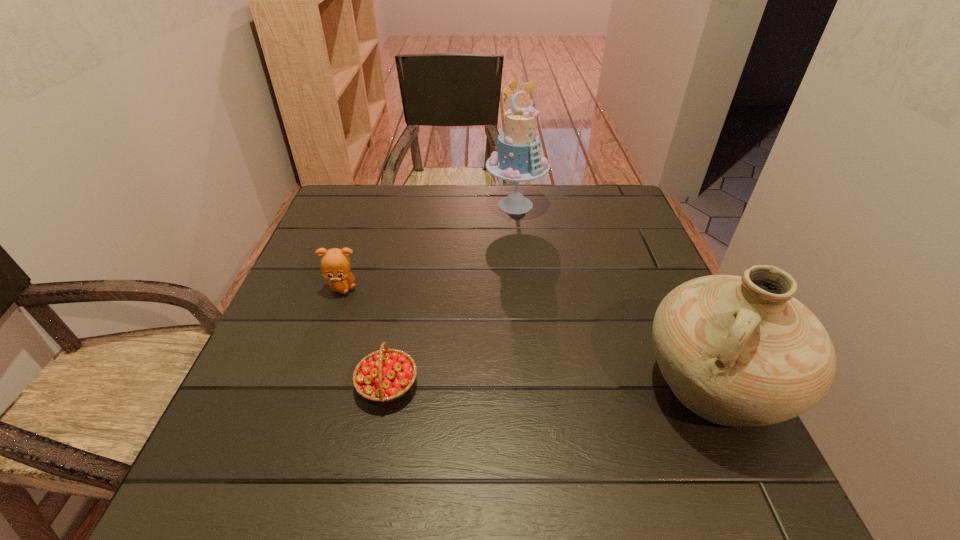
Find the location of `vacant region that satisfies the following two spatial constraints: 1. on the front side of the strawberry; 2. on the right side of the pottery`. vacant region that satisfies the following two spatial constraints: 1. on the front side of the strawberry; 2. on the right side of the pottery is located at coordinates (387, 386).

Identify the location of vacant position in the image that satisfies the following two spatial constraints: 1. on the front side of the third shortest object; 2. on the right side of the second farthest object. The width and height of the screenshot is (960, 540). (309, 386).